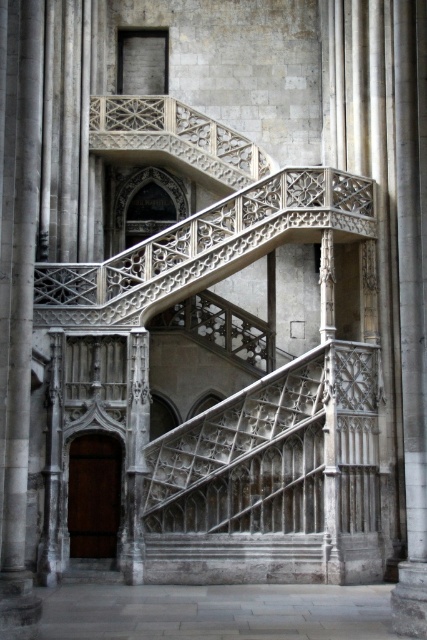
Does carved stone balustrade at center have a lesser width compared to gray stone pillar at center?

Incorrect, carved stone balustrade at center's width is not less than gray stone pillar at center's.

What do you see at coordinates (204, 248) in the screenshot? I see `carved stone balustrade at center` at bounding box center [204, 248].

Does point (356, 193) lie behind point (20, 74)?

That is True.

The width and height of the screenshot is (427, 640). In order to click on carved stone balustrade at center in this screenshot , I will do `click(204, 248)`.

Who is more distant from viewer, (178,259) or (404,285)?

The point (178,259) is more distant.

Does carved stone balustrade at center appear on the left side of smooth stone pillar at center?

Correct, you'll find carved stone balustrade at center to the left of smooth stone pillar at center.

Between point (170, 284) and point (415, 140), which one is positioned behind?

Positioned behind is point (170, 284).

You are a GUI agent. You are given a task and a screenshot of the screen. Output one action in this format:
    pyautogui.click(x=<x>, y=<y>)
    Task: Click on the carved stone balustrade at center
    This screenshot has width=427, height=640.
    Given the screenshot: What is the action you would take?
    pyautogui.click(x=204, y=248)

Which of these two, white stone staircase at center or smooth stone pillar at center, stands taller?

With more height is smooth stone pillar at center.

Between white stone staircase at center and smooth stone pillar at center, which one appears on the left side from the viewer's perspective?

white stone staircase at center

Does point (342, 461) come in front of point (415, 516)?

No.

This screenshot has height=640, width=427. What are the coordinates of `white stone staircase at center` in the screenshot? It's located at (272, 480).